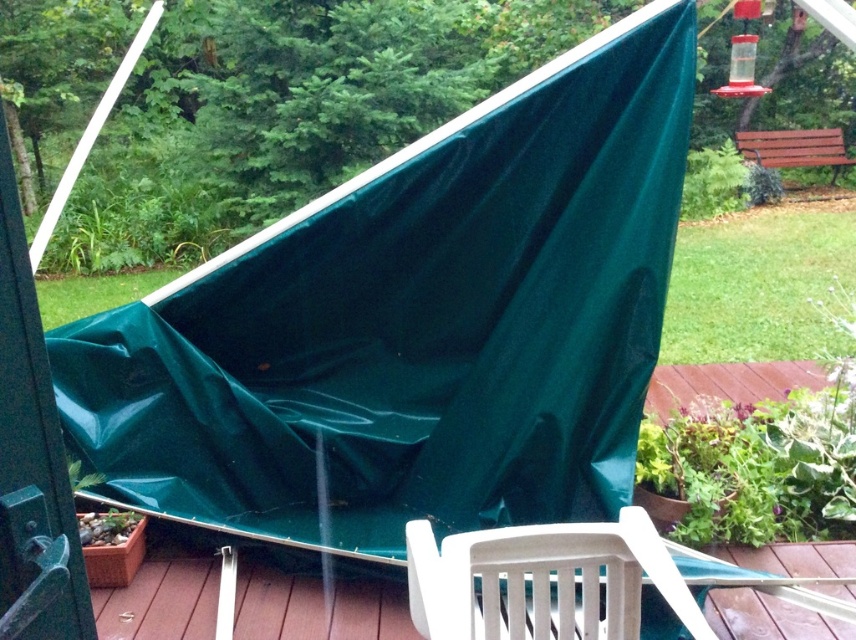
Does green tarp at upper center have a larger size compared to green tarp at left?

Correct, green tarp at upper center is larger in size than green tarp at left.

Is green tarp at upper center closer to the viewer compared to green tarp at left?

No.

What do you see at coordinates (415, 326) in the screenshot? I see `green tarp at upper center` at bounding box center [415, 326].

Find the location of a particular element. The image size is (856, 640). green tarp at upper center is located at coordinates (415, 326).

Is point (129, 436) farther from camera compared to point (627, 560)?

Yes, it is behind point (627, 560).

Does green tarp at upper center have a greater width compared to white plastic chair at lower center?

Indeed, green tarp at upper center has a greater width compared to white plastic chair at lower center.

Is point (583, 131) in front of point (611, 624)?

That is False.

Identify the location of green tarp at upper center. (415, 326).

Between brown wood deck at lower center and white plastic chair at lower center, which one appears on the left side from the viewer's perspective?

Positioned to the left is brown wood deck at lower center.

I want to click on brown wood deck at lower center, so pyautogui.click(x=162, y=600).